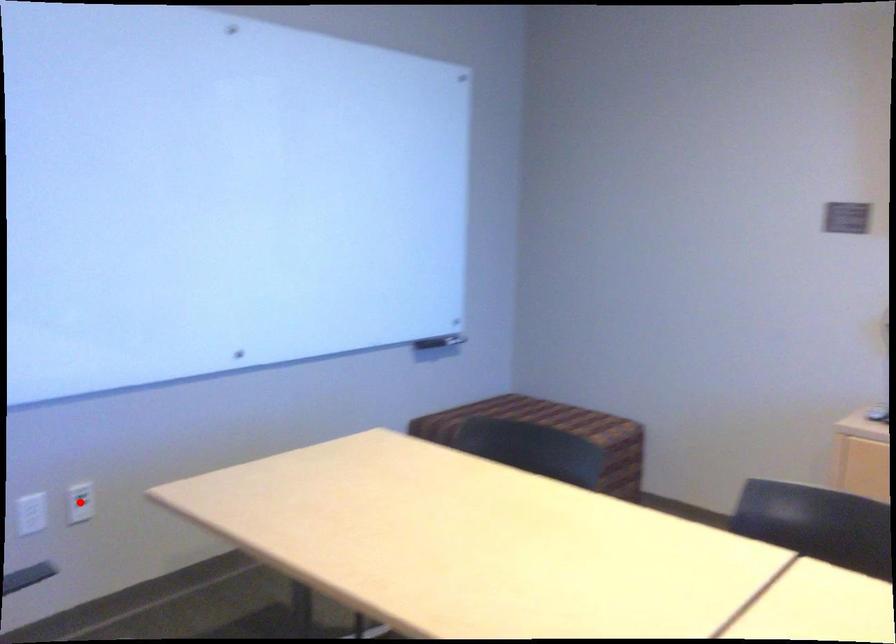
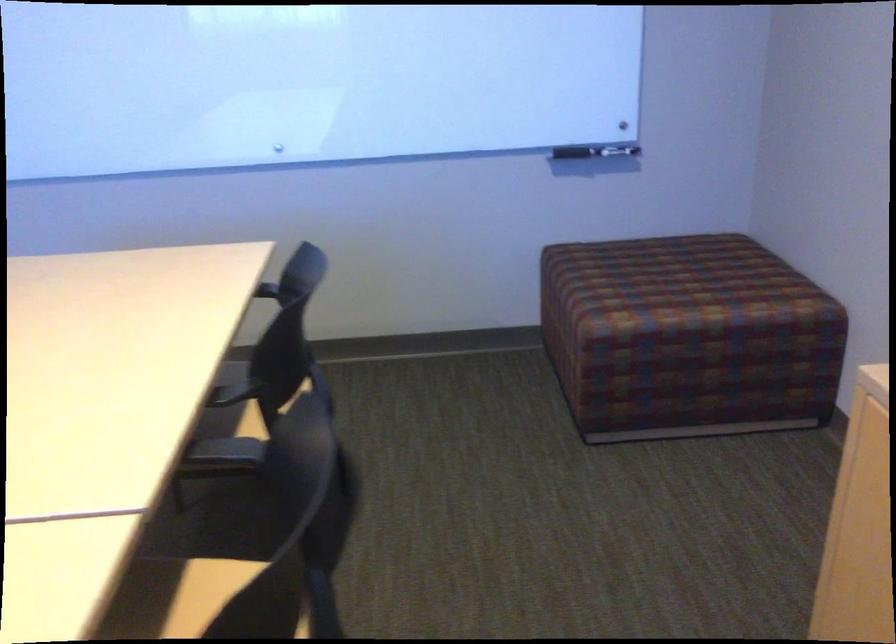
Question: I am providing you with two images of the same scene from different viewpoints. A red point is marked on the first image. At the location where the point appears in image 1, is it still visible in image 2?

Choices:
 (A) Yes
 (B) No

Answer: (B)